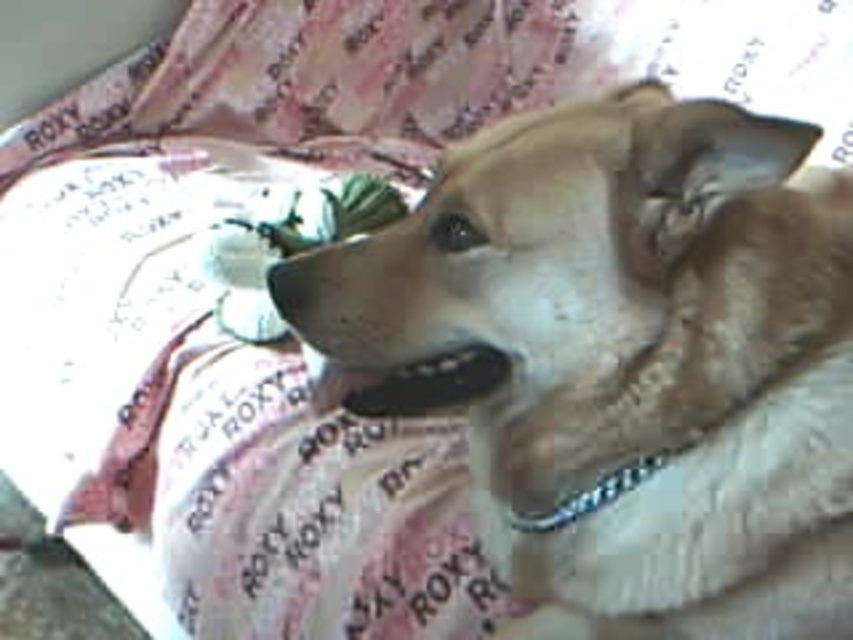
Question: Can you confirm if light brown fur at center is positioned above green fabric flower at center?

Choices:
 (A) yes
 (B) no

Answer: (B)

Question: Considering the real-world distances, which object is closest to the metallic chain at center?

Choices:
 (A) light brown fur at center
 (B) green fabric flower at center

Answer: (A)

Question: Which object appears closest to the camera in this image?

Choices:
 (A) green fabric flower at center
 (B) light brown fur at center
 (C) metallic chain at center

Answer: (B)

Question: Is light brown fur at center below metallic chain at center?

Choices:
 (A) yes
 (B) no

Answer: (B)

Question: Does light brown fur at center lie in front of green fabric flower at center?

Choices:
 (A) yes
 (B) no

Answer: (A)

Question: Which object appears closest to the camera in this image?

Choices:
 (A) green fabric flower at center
 (B) metallic chain at center
 (C) light brown fur at center

Answer: (C)